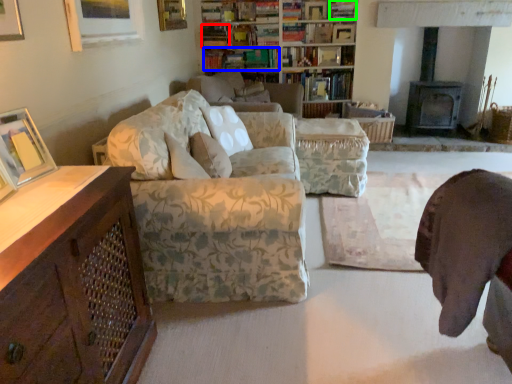
Question: Based on their relative distances, which object is farther from book (highlighted by a red box)? Choose from book (highlighted by a blue box) and book (highlighted by a green box).

Choices:
 (A) book
 (B) book

Answer: (B)